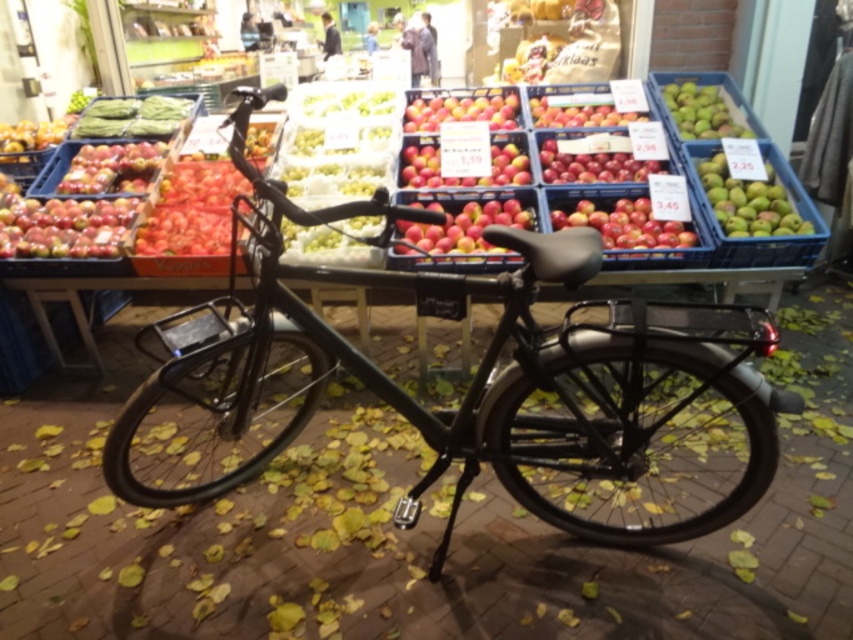
You are a delivery person who needs to pick up a green matte apple at upper right from the market stall. Your bicycle is the matte black bicycle at center. Can you reach the apple without moving the bicycle?

The matte black bicycle at center is 1.93 meters away from the green matte apple at upper right. Since the distance is more than arm length, you cannot reach the apple without moving the bicycle.

You are a delivery person who needs to load a basket of apples from the blue plastic crate in the background onto the matte black bicycle at center. Given that the bicycle is at point 0.595, 0.553, can you determine the direction you should move relative to the bicycle to reach the blue plastic crates?

The blue plastic crates are in the background, so you should move away from the matte black bicycle at center towards the background to reach them.

You are a customer at the market and want to pick both the matte red apple at left and the green matte apple at upper right. Which apple do you need to reach down lower to pick first?

The matte red apple at left is located below the green matte apple at upper right, so you need to reach down lower to pick the matte red apple at left first.